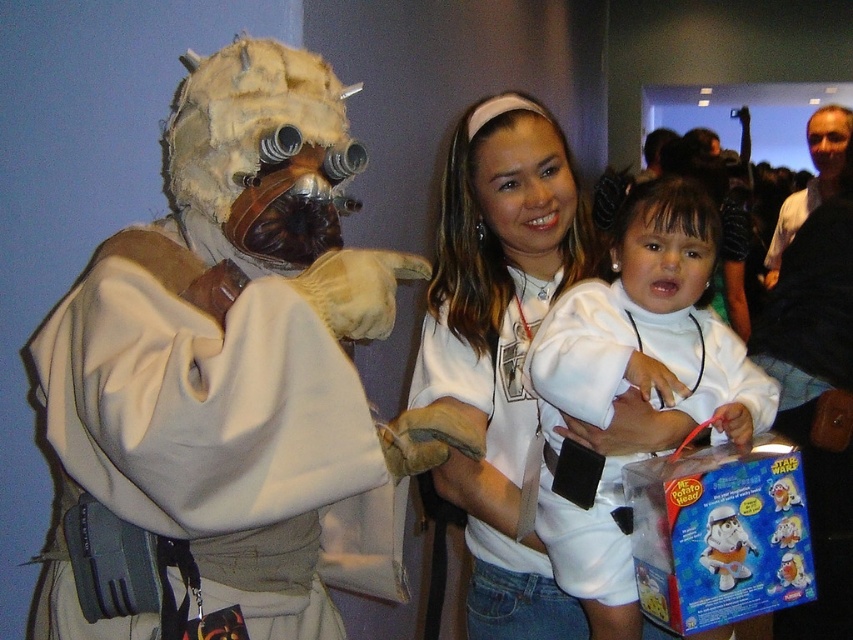
You are at a convention and see the fuzzy beige costume at left and the plastic toy at center. If you want to carry both items home, which one should you pack first into your small backpack to ensure both fit?

The fuzzy beige costume at left is bigger than the plastic toy at center, so you should pack the fuzzy beige costume at left first to make sure both items fit in your backpack.